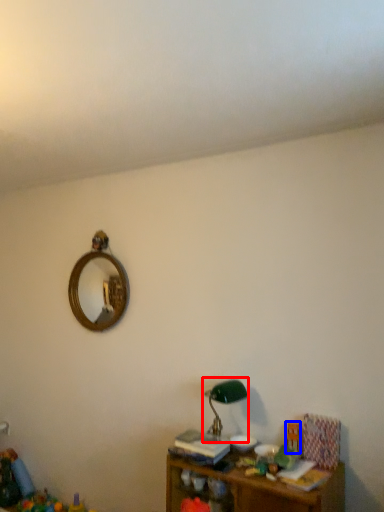
Question: Which object appears farthest to the camera in this image, table lamp (highlighted by a red box) or toy (highlighted by a blue box)?

Choices:
 (A) table lamp
 (B) toy

Answer: (B)